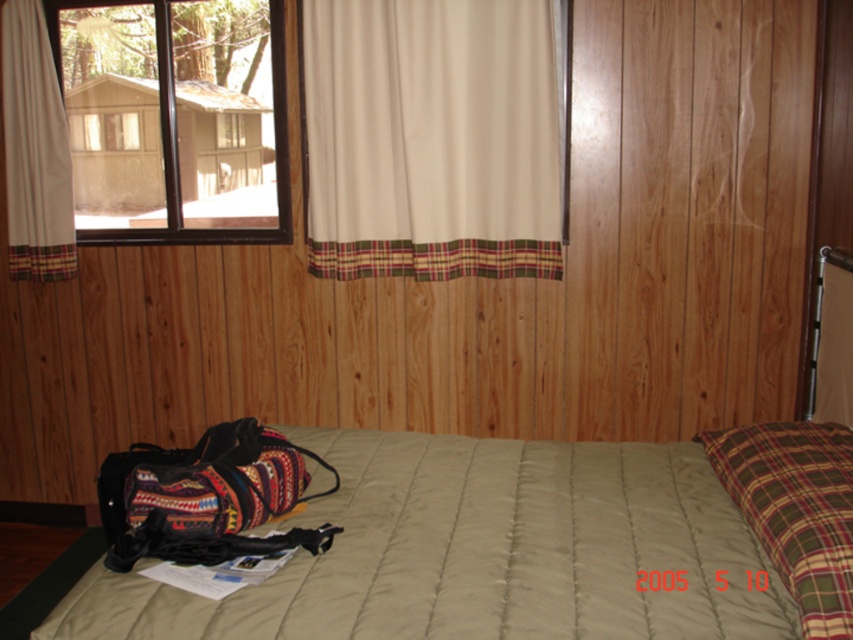
Question: Among these points, which one is nearest to the camera?

Choices:
 (A) (99, 128)
 (B) (3, 67)

Answer: (B)

Question: Can you confirm if beige quilt at center is bigger than plaid fabric pillow at right?

Choices:
 (A) no
 (B) yes

Answer: (B)

Question: Which object appears farthest from the camera in this image?

Choices:
 (A) clear glass window at upper left
 (B) plaid fabric pillow at right
 (C) beige fabric curtain at upper center

Answer: (A)

Question: Is beige quilt at center below beige fabric curtain at upper center?

Choices:
 (A) yes
 (B) no

Answer: (A)

Question: Is beige fabric curtain at upper center thinner than multicolored woven duffel at lower left?

Choices:
 (A) yes
 (B) no

Answer: (B)

Question: Which of the following is the closest to the observer?

Choices:
 (A) clear glass window at upper left
 (B) beige fabric curtain at upper center
 (C) multicolored woven duffel at lower left
 (D) beige quilt at center

Answer: (D)